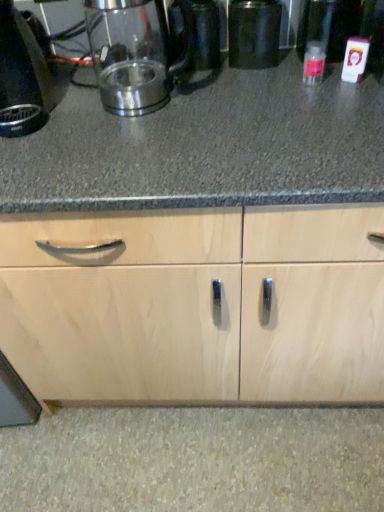
Question: From the image's perspective, is clear plastic bottle at right on metallic black canister at center?

Choices:
 (A) no
 (B) yes

Answer: (A)

Question: Considering the relative sizes of clear plastic bottle at right and metallic black canister at center in the image provided, is clear plastic bottle at right wider than metallic black canister at center?

Choices:
 (A) yes
 (B) no

Answer: (B)

Question: From a real-world perspective, is clear plastic bottle at right physically below metallic black canister at center?

Choices:
 (A) yes
 (B) no

Answer: (A)

Question: Is clear plastic bottle at right not near metallic black canister at center?

Choices:
 (A) yes
 (B) no

Answer: (B)

Question: Is clear plastic bottle at right oriented away from metallic black canister at center?

Choices:
 (A) no
 (B) yes

Answer: (A)

Question: Does clear plastic bottle at right have a smaller size compared to metallic black canister at center?

Choices:
 (A) yes
 (B) no

Answer: (A)

Question: Is clear plastic bottle at right surrounding black plastic kettle at left?

Choices:
 (A) no
 (B) yes

Answer: (A)

Question: Is clear plastic bottle at right positioned with its back to black plastic kettle at left?

Choices:
 (A) yes
 (B) no

Answer: (B)

Question: Can you confirm if clear plastic bottle at right is thinner than black plastic kettle at left?

Choices:
 (A) yes
 (B) no

Answer: (A)

Question: Does clear plastic bottle at right have a smaller size compared to black plastic kettle at left?

Choices:
 (A) no
 (B) yes

Answer: (B)

Question: Can you confirm if clear plastic bottle at right is wider than black plastic kettle at left?

Choices:
 (A) yes
 (B) no

Answer: (B)

Question: Is clear plastic bottle at right further to camera compared to black plastic kettle at left?

Choices:
 (A) yes
 (B) no

Answer: (A)

Question: Considering the relative sizes of metallic black canister at center and clear plastic bottle at right in the image provided, is metallic black canister at center smaller than clear plastic bottle at right?

Choices:
 (A) no
 (B) yes

Answer: (A)